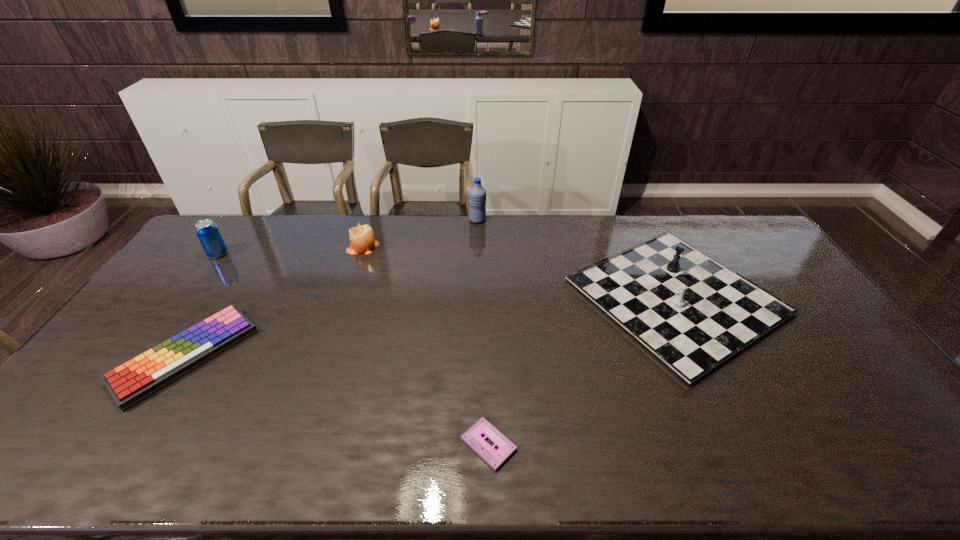
Image resolution: width=960 pixels, height=540 pixels. I want to click on computer keyboard present at the left edge, so click(132, 382).

This screenshot has height=540, width=960. In order to click on object that is at the right edge in this screenshot , I will do `click(693, 313)`.

At what (x,y) coordinates should I click in order to perform the action: click on object situated at the far left corner. Please return your answer as a coordinate pair (x, y). The image size is (960, 540). Looking at the image, I should click on (207, 231).

Locate an element on the screen. Image resolution: width=960 pixels, height=540 pixels. object situated at the far right corner is located at coordinates (693, 313).

The image size is (960, 540). What are the coordinates of `vacant area at the far edge of the desktop` in the screenshot? It's located at tap(612, 237).

In the image, there is a desktop. Identify the location of vacant space at the near edge. Image resolution: width=960 pixels, height=540 pixels. (608, 441).

What are the coordinates of `free space between the tallest object and the fourth object from right to left` in the screenshot? It's located at (420, 233).

Image resolution: width=960 pixels, height=540 pixels. Find the location of `vacant space that is in between the beer can and the fourth object from right to left`. vacant space that is in between the beer can and the fourth object from right to left is located at coordinates (291, 251).

At what (x,y) coordinates should I click in order to perform the action: click on vacant space that's between the rightmost object and the candle. Please return your answer as a coordinate pair (x, y). This screenshot has width=960, height=540. Looking at the image, I should click on (519, 272).

At what (x,y) coordinates should I click in order to perform the action: click on unoccupied area between the candle and the second shortest object. Please return your answer as a coordinate pair (x, y). Image resolution: width=960 pixels, height=540 pixels. Looking at the image, I should click on (275, 302).